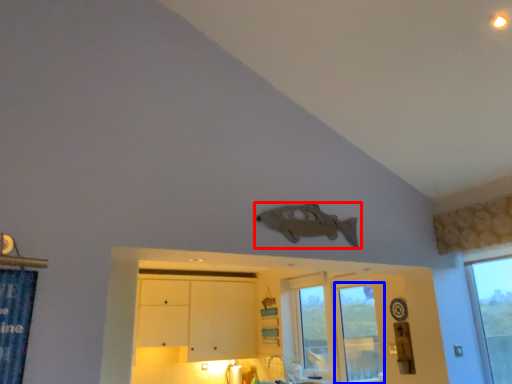
Question: Which of the following is the closest to the observer, fish (highlighted by a red box) or window (highlighted by a blue box)?

Choices:
 (A) fish
 (B) window

Answer: (A)